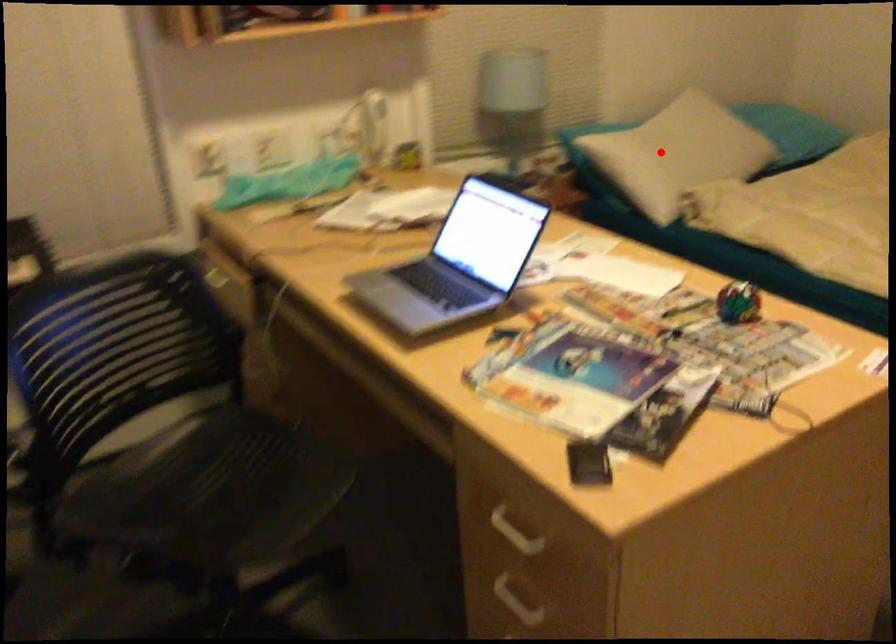
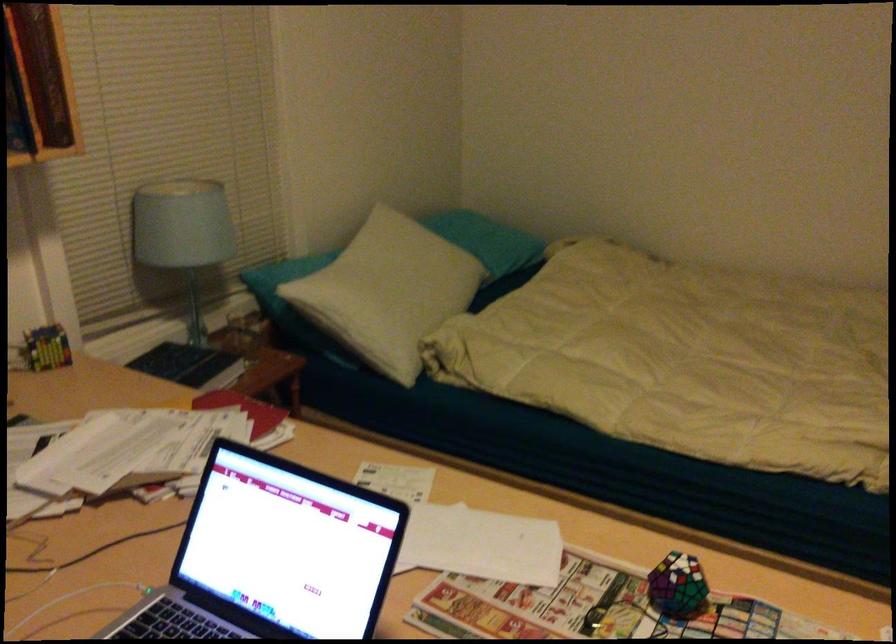
Where in the second image is the point corresponding to the highlighted location from the first image?

(389, 292)